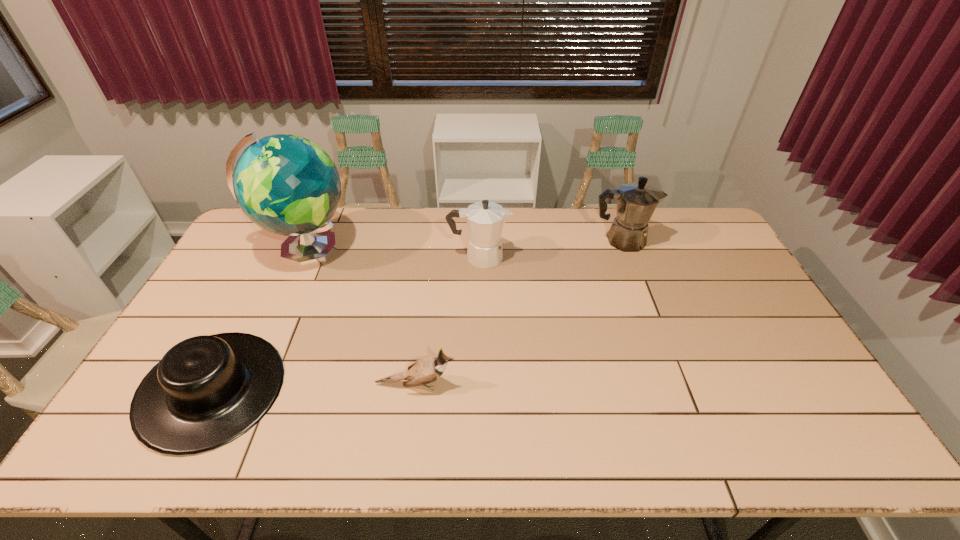
This screenshot has width=960, height=540. Identify the location of globe positioned at the far edge. [287, 185].

You are a GUI agent. You are given a task and a screenshot of the screen. Output one action in this format:
    pyautogui.click(x=<x>, y=<y>)
    Task: Click on the object that is at the near edge
    
    Given the screenshot: What is the action you would take?
    pyautogui.click(x=206, y=391)

Image resolution: width=960 pixels, height=540 pixels. I want to click on globe present at the left edge, so click(287, 185).

The width and height of the screenshot is (960, 540). I want to click on dress hat that is at the left edge, so click(x=206, y=391).

Locate an element on the screen. This screenshot has width=960, height=540. object that is at the far left corner is located at coordinates (287, 185).

The height and width of the screenshot is (540, 960). What are the coordinates of `object that is at the near left corner` in the screenshot? It's located at (206, 391).

Locate an element on the screen. vacant space at the far edge of the desktop is located at coordinates (583, 240).

The image size is (960, 540). I want to click on blank space at the near edge of the desktop, so click(665, 432).

Find the location of a particular element. vacant region at the left edge of the desktop is located at coordinates (272, 250).

Identify the location of free space at the right edge of the desktop. The image size is (960, 540). (804, 386).